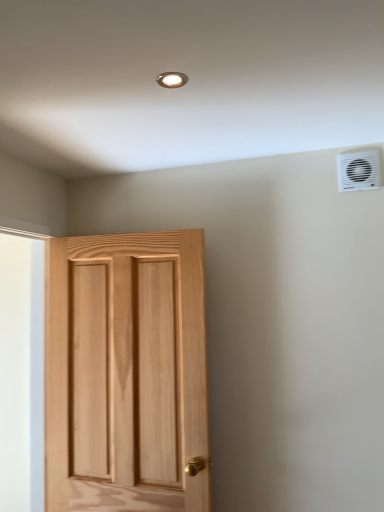
Question: Can we say white plastic air conditioning unit at upper right lies outside natural wood door at left?

Choices:
 (A) yes
 (B) no

Answer: (A)

Question: Is white plastic air conditioning unit at upper right to the right of natural wood door at left from the viewer's perspective?

Choices:
 (A) no
 (B) yes

Answer: (B)

Question: Is white plastic air conditioning unit at upper right positioned in front of natural wood door at left?

Choices:
 (A) no
 (B) yes

Answer: (A)

Question: Considering the relative sizes of white plastic air conditioning unit at upper right and natural wood door at left in the image provided, is white plastic air conditioning unit at upper right taller than natural wood door at left?

Choices:
 (A) no
 (B) yes

Answer: (A)

Question: Does white plastic air conditioning unit at upper right lie behind natural wood door at left?

Choices:
 (A) yes
 (B) no

Answer: (A)

Question: Does white plastic air conditioning unit at upper right have a greater width compared to natural wood door at left?

Choices:
 (A) no
 (B) yes

Answer: (A)

Question: From the image's perspective, does white plastic air conditioning unit at upper right appear higher than matte silver light fixture at upper center?

Choices:
 (A) yes
 (B) no

Answer: (B)

Question: Is white plastic air conditioning unit at upper right outside matte silver light fixture at upper center?

Choices:
 (A) no
 (B) yes

Answer: (B)

Question: Is matte silver light fixture at upper center surrounded by white plastic air conditioning unit at upper right?

Choices:
 (A) no
 (B) yes

Answer: (A)

Question: Considering the relative sizes of white plastic air conditioning unit at upper right and matte silver light fixture at upper center in the image provided, is white plastic air conditioning unit at upper right taller than matte silver light fixture at upper center?

Choices:
 (A) no
 (B) yes

Answer: (B)

Question: Can you confirm if white plastic air conditioning unit at upper right is shorter than matte silver light fixture at upper center?

Choices:
 (A) no
 (B) yes

Answer: (A)

Question: Is white plastic air conditioning unit at upper right in contact with matte silver light fixture at upper center?

Choices:
 (A) no
 (B) yes

Answer: (A)

Question: Is matte silver light fixture at upper center completely or partially outside of white plastic air conditioning unit at upper right?

Choices:
 (A) no
 (B) yes

Answer: (B)